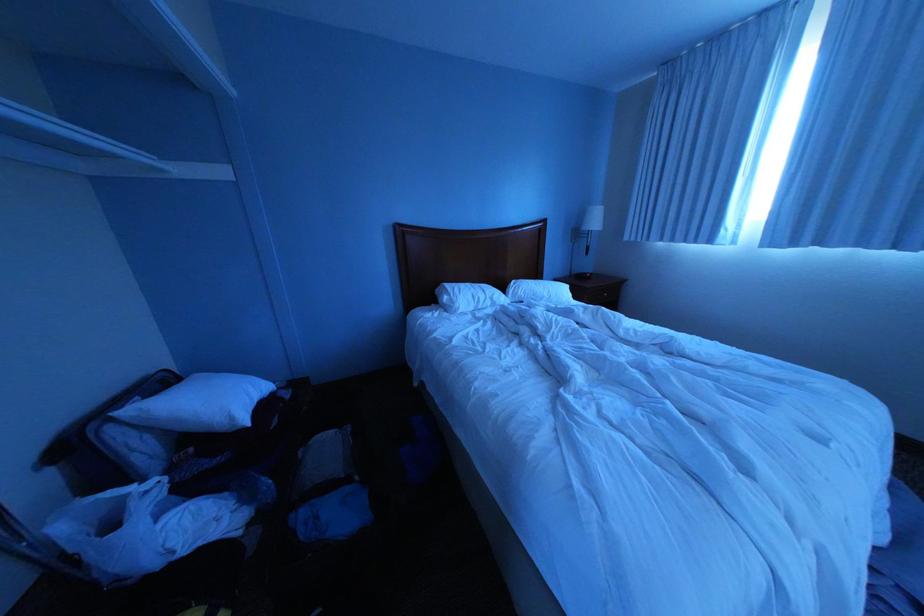
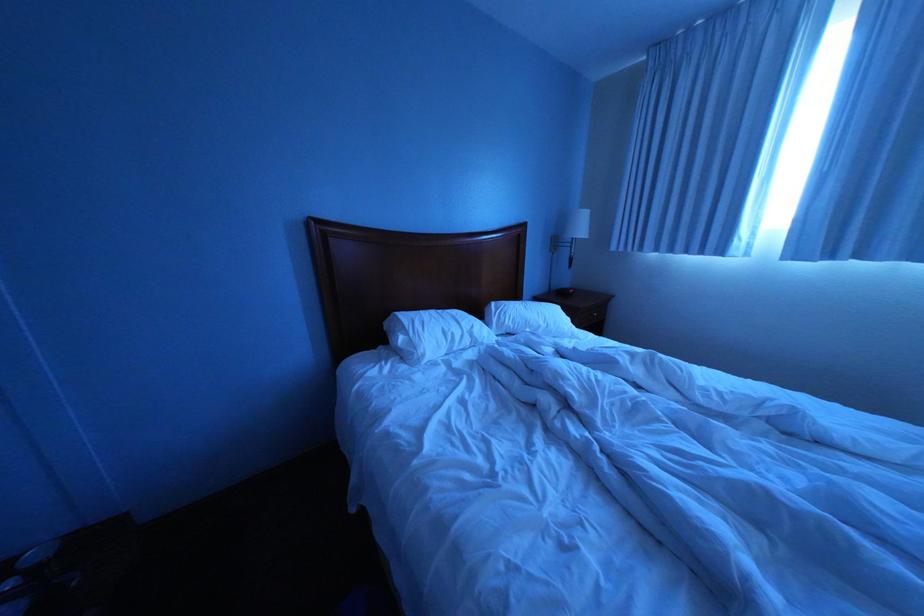
Question: What movement of the cameraman would produce the second image?

Choices:
 (A) Left
 (B) Right
 (C) Forward
 (D) Backward

Answer: (C)